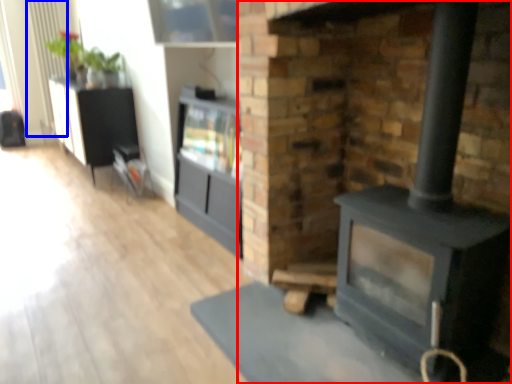
Question: Which object is further to the camera taking this photo, fireplace (highlighted by a red box) or radiator (highlighted by a blue box)?

Choices:
 (A) fireplace
 (B) radiator

Answer: (B)